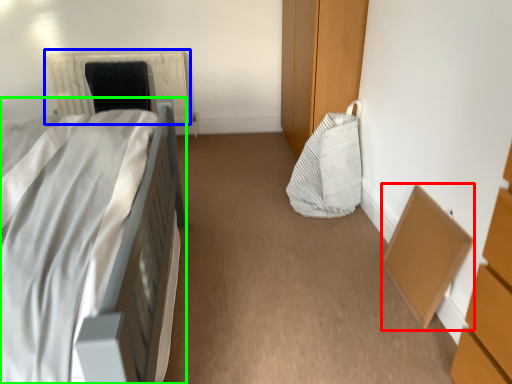
Question: Which object is the farthest from cardboard box (highlighted by a red box)? Choose among these: radiator (highlighted by a blue box) or bed (highlighted by a green box).

Choices:
 (A) radiator
 (B) bed

Answer: (A)